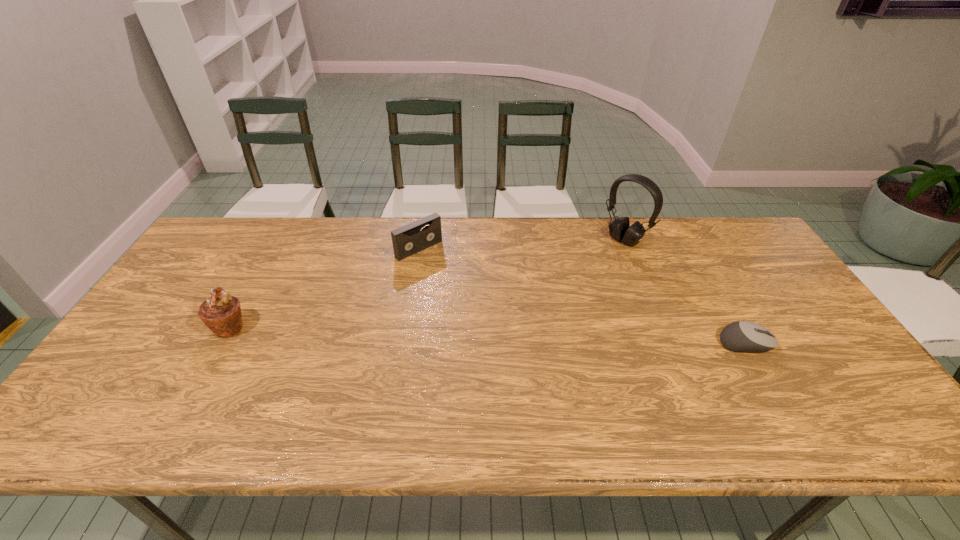
Identify the location of free area in between the tallest object and the videotape. Image resolution: width=960 pixels, height=540 pixels. (522, 245).

Where is `free area in between the tallest object and the shortest object`? The width and height of the screenshot is (960, 540). free area in between the tallest object and the shortest object is located at coordinates (685, 292).

The height and width of the screenshot is (540, 960). I want to click on vacant point located between the second object from left to right and the rightmost object, so click(583, 296).

Find the location of a particular element. Image resolution: width=960 pixels, height=540 pixels. free point between the shortest object and the headset is located at coordinates (685, 292).

Find the location of `free space between the leftmost object and the headset`. free space between the leftmost object and the headset is located at coordinates 427,284.

Where is `empty space between the computer equipment and the third object from right to left`? The image size is (960, 540). empty space between the computer equipment and the third object from right to left is located at coordinates coord(583,296).

Find the location of a particular element. This screenshot has width=960, height=540. object that can be found as the second closest to the tallest object is located at coordinates (407, 240).

Locate an element on the screen. object that ranks as the third closest to the second object from right to left is located at coordinates (221, 313).

This screenshot has height=540, width=960. In order to click on vacant space that satisfies the following two spatial constraints: 1. on the front side of the rightmost object; 2. on the wheel side of the muffin in this screenshot , I will do `click(221, 343)`.

Find the location of a particular element. vacant space that satisfies the following two spatial constraints: 1. on the back side of the third shortest object; 2. on the left side of the second object from right to left is located at coordinates (278, 240).